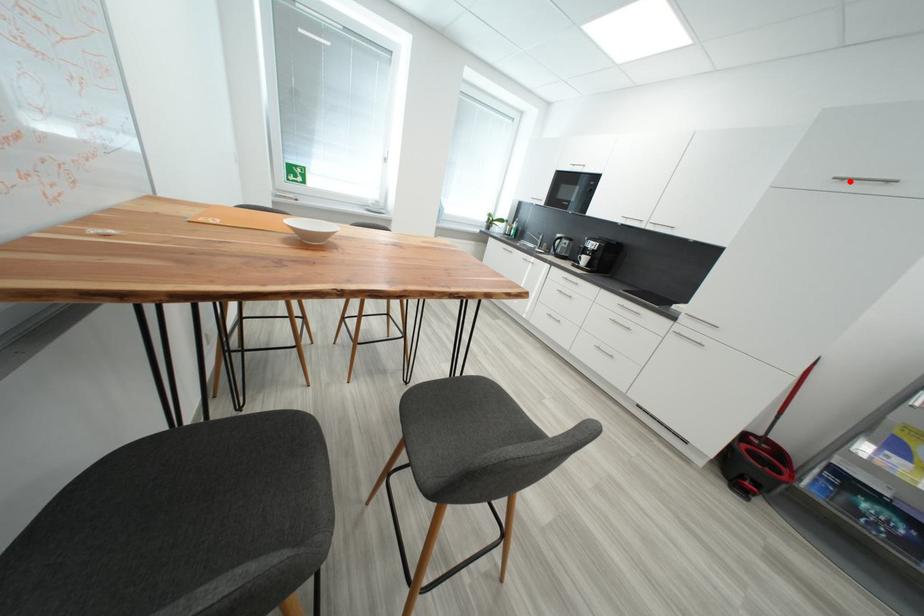
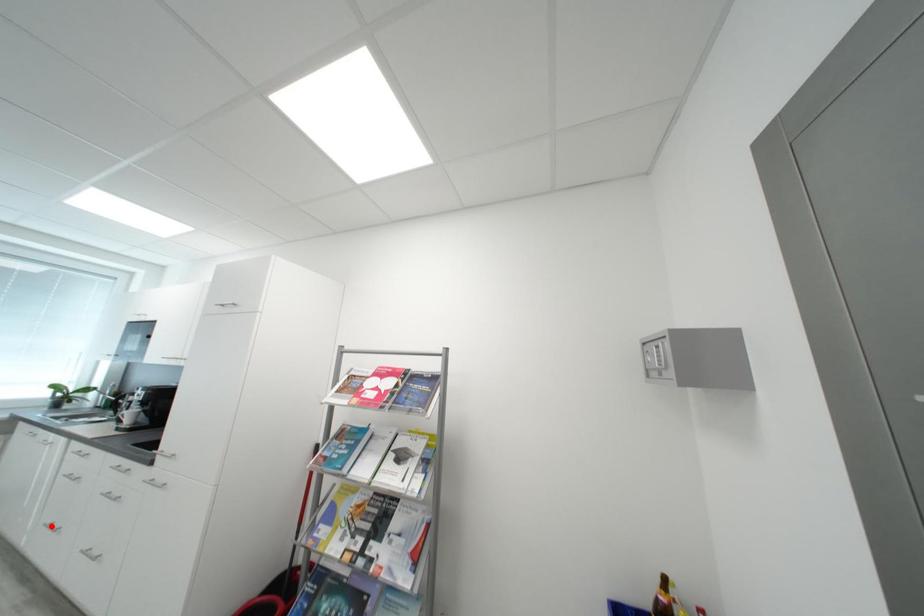
I am providing you with two images of the same scene from different viewpoints. A red point is marked on the first image and another point is marked on the second image. Is the marked point in image1 the same physical position as the marked point in image2?

No